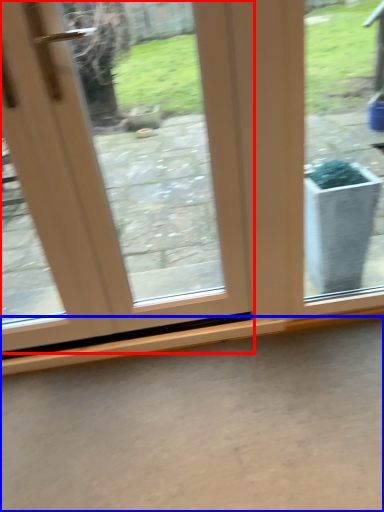
Question: Which object appears closest to the camera in this image, door (highlighted by a red box) or concrete (highlighted by a blue box)?

Choices:
 (A) door
 (B) concrete

Answer: (A)